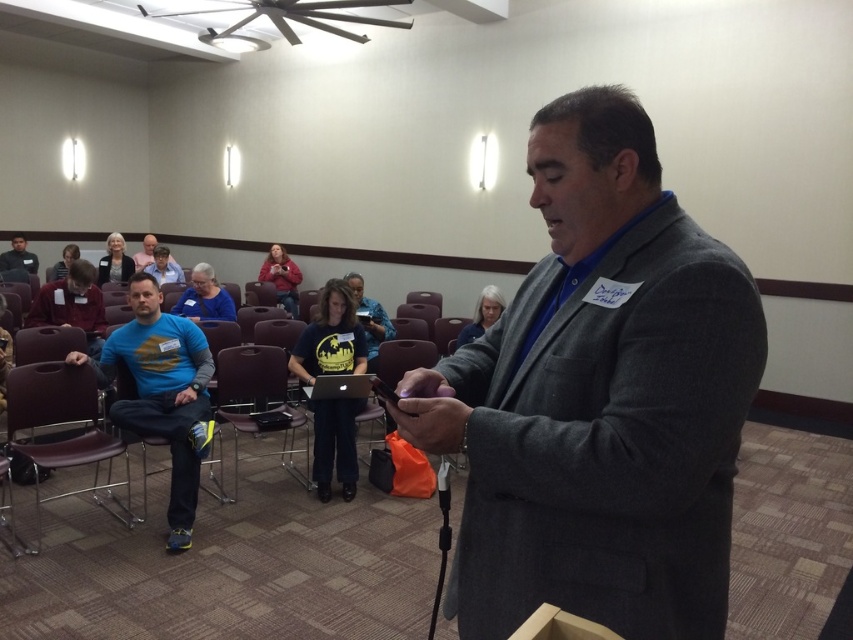
You are attending a conference and need to decide which item to place on the table. The blue fabric shirt at center and the gray fabric at center are both on the table. Which one has a larger width?

The blue fabric shirt at center has a larger width than the gray fabric at center.

You are an interior designer observing the conference room setup. You notice the matte red sweater at center and the gray fabric at center. Which object is positioned higher in the scene?

The matte red sweater at center is located above the gray fabric at center, so it is positioned higher in the scene.